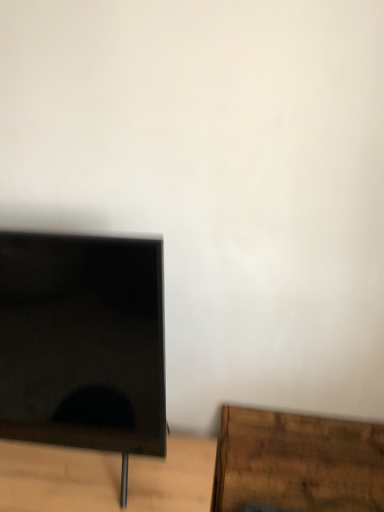
Question: Is brown wood table at lower right taller than black glossy monitor at left?

Choices:
 (A) no
 (B) yes

Answer: (A)

Question: Is the depth of brown wood table at lower right greater than that of black glossy monitor at left?

Choices:
 (A) no
 (B) yes

Answer: (B)

Question: Is brown wood table at lower right not inside black glossy monitor at left?

Choices:
 (A) no
 (B) yes

Answer: (B)

Question: From a real-world perspective, is brown wood table at lower right located higher than black glossy monitor at left?

Choices:
 (A) no
 (B) yes

Answer: (A)

Question: Considering the relative positions of brown wood table at lower right and black glossy monitor at left in the image provided, is brown wood table at lower right to the right of black glossy monitor at left from the viewer's perspective?

Choices:
 (A) yes
 (B) no

Answer: (A)

Question: Is brown wood table at lower right far from black glossy monitor at left?

Choices:
 (A) yes
 (B) no

Answer: (B)

Question: Is black glossy monitor at left shorter than brown wooden table at lower left?

Choices:
 (A) no
 (B) yes

Answer: (A)

Question: From a real-world perspective, is black glossy monitor at left located higher than brown wooden table at lower left?

Choices:
 (A) yes
 (B) no

Answer: (A)

Question: Is the depth of black glossy monitor at left less than that of brown wooden table at lower left?

Choices:
 (A) no
 (B) yes

Answer: (B)

Question: Is black glossy monitor at left facing towards brown wooden table at lower left?

Choices:
 (A) yes
 (B) no

Answer: (B)

Question: Is black glossy monitor at left at the left side of brown wooden table at lower left?

Choices:
 (A) no
 (B) yes

Answer: (B)

Question: Can you confirm if black glossy monitor at left is thinner than brown wooden table at lower left?

Choices:
 (A) no
 (B) yes

Answer: (B)

Question: Is brown wooden table at lower left at the back of brown wood table at lower right?

Choices:
 (A) yes
 (B) no

Answer: (B)